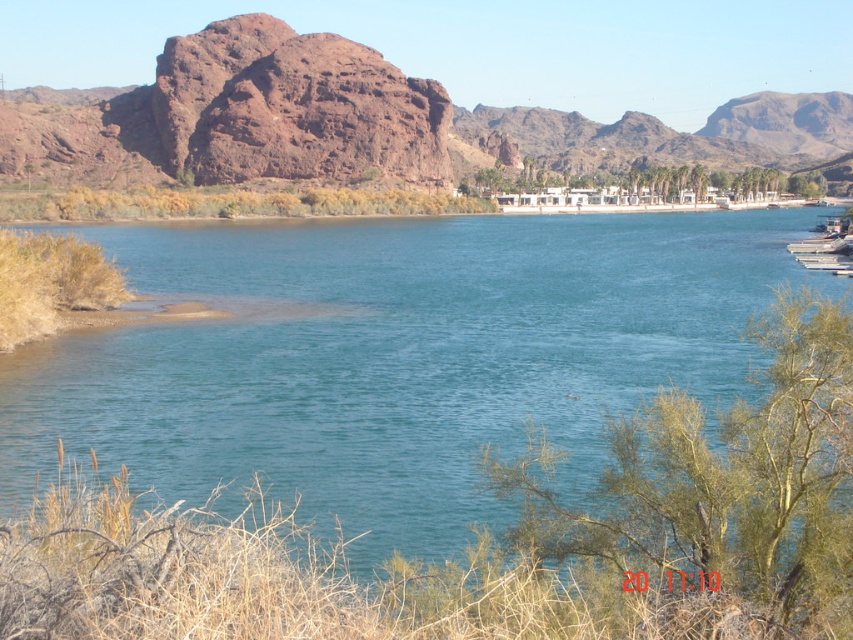
You are an architect designing a new observation deck that needs to be placed near the blue water at center and the rustic rock formation at upper center. Since the deck must be larger than both objects, which object should you prioritize placing the deck closer to to ensure it doesn t block the view of the smaller one?

The blue water at center is smaller in size compared to the rustic rock formation at upper center. To ensure the observation deck doesn t block the view of the smaller blue water at center, prioritize placing the deck closer to the larger rustic rock formation at upper center.